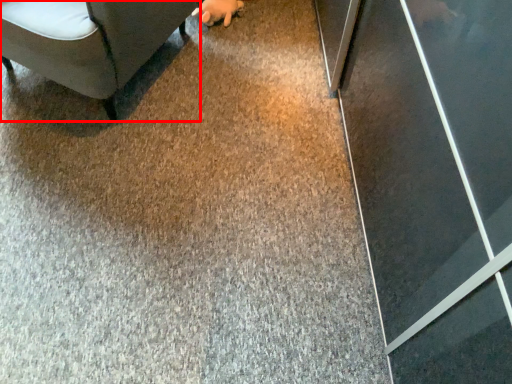
Question: From the image's perspective, what is the correct spatial relationship of furniture (annotated by the red box) in relation to hand?

Choices:
 (A) above
 (B) below

Answer: (B)